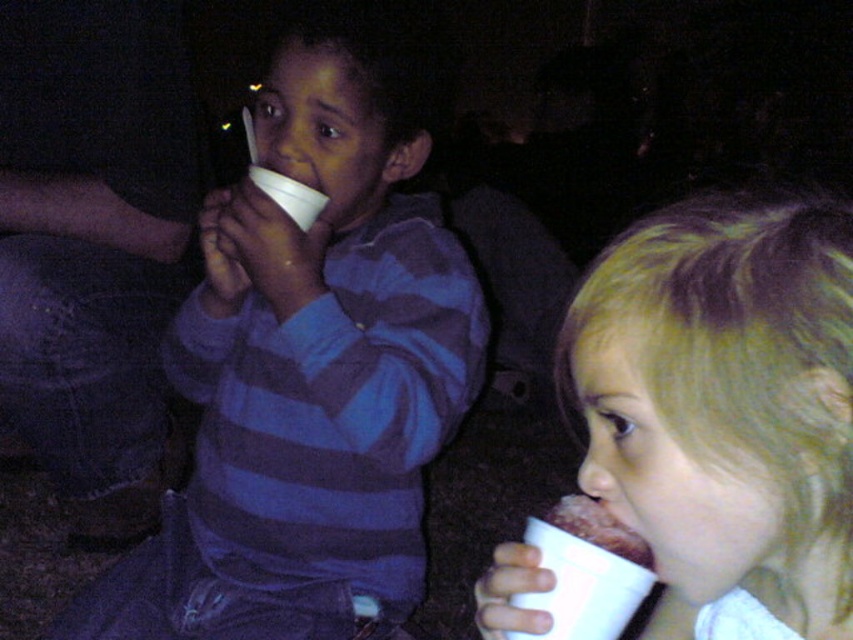
Question: Which object is farther from the camera taking this photo?

Choices:
 (A) matte paper cup at center
 (B) chocolate cake at lower right
 (C) white paper cup at right

Answer: (A)

Question: Observing the image, what is the correct spatial positioning of matte paper cup at center in reference to white paper cup at right?

Choices:
 (A) below
 (B) above

Answer: (B)

Question: Is white paper cup at right bigger than chocolate cake at lower right?

Choices:
 (A) no
 (B) yes

Answer: (B)

Question: Which point appears closest to the camera in this image?

Choices:
 (A) (587, 500)
 (B) (238, 461)
 (C) (683, 234)

Answer: (C)

Question: Can you confirm if matte paper cup at center is positioned below chocolate cake at lower right?

Choices:
 (A) no
 (B) yes

Answer: (A)

Question: Which point is farther to the camera?

Choices:
 (A) chocolate cake at lower right
 (B) matte paper cup at center

Answer: (B)